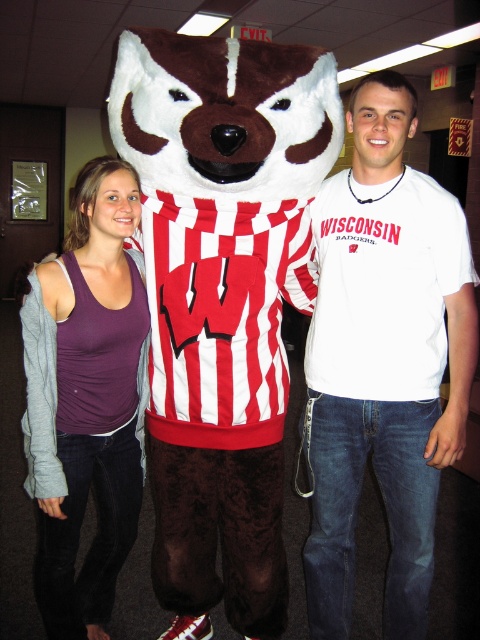
Question: From the image, what is the correct spatial relationship of brown plush badger at center in relation to purple matte tank top at center-left?

Choices:
 (A) below
 (B) above

Answer: (B)

Question: Which point is farther from the camera taking this photo?

Choices:
 (A) (167, 232)
 (B) (59, 506)

Answer: (B)

Question: Estimate the real-world distances between objects in this image. Which object is closer to the purple matte tank top at center-left?

Choices:
 (A) white cotton t-shirt at center
 (B) brown plush badger at center

Answer: (B)

Question: Which point is farther from the camera taking this photo?

Choices:
 (A) click(332, 625)
 (B) click(119, 202)
 (C) click(239, 596)

Answer: (A)

Question: Considering the relative positions of brown plush badger at center and purple matte tank top at center-left in the image provided, where is brown plush badger at center located with respect to purple matte tank top at center-left?

Choices:
 (A) above
 (B) below

Answer: (A)

Question: Can you confirm if white cotton t-shirt at center is positioned above purple matte tank top at center-left?

Choices:
 (A) no
 (B) yes

Answer: (B)